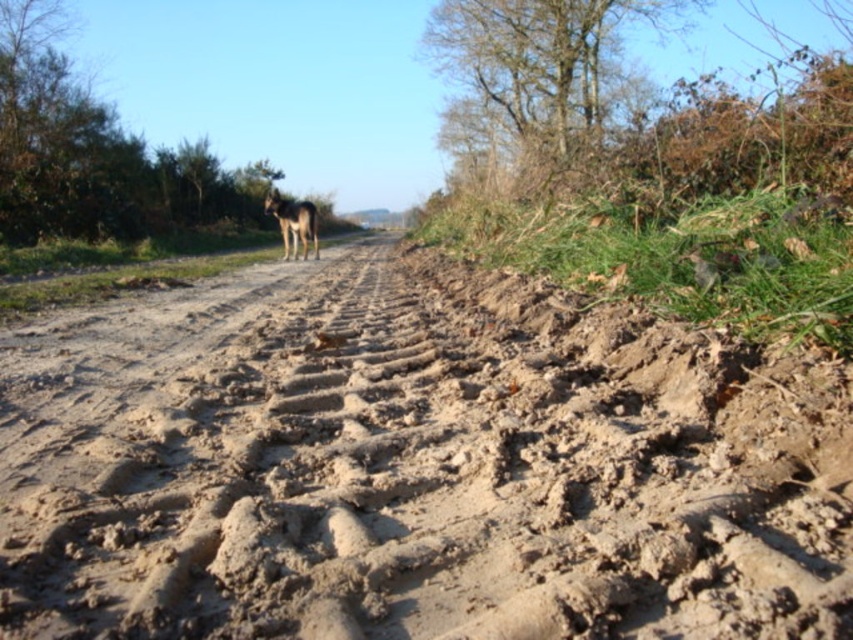
Question: Does dry mud track at center come behind brown fur dog at center?

Choices:
 (A) yes
 (B) no

Answer: (B)

Question: Among these objects, which one is farthest from the camera?

Choices:
 (A) brown fur dog at center
 (B) dry mud track at center

Answer: (A)

Question: Does dry mud track at center have a greater width compared to brown fur dog at center?

Choices:
 (A) yes
 (B) no

Answer: (B)

Question: Which of the following is the farthest from the observer?

Choices:
 (A) (566, 412)
 (B) (302, 250)

Answer: (B)

Question: Which of the following is the closest to the observer?

Choices:
 (A) (341, 381)
 (B) (306, 218)

Answer: (A)

Question: Is dry mud track at center closer to camera compared to brown fur dog at center?

Choices:
 (A) no
 (B) yes

Answer: (B)